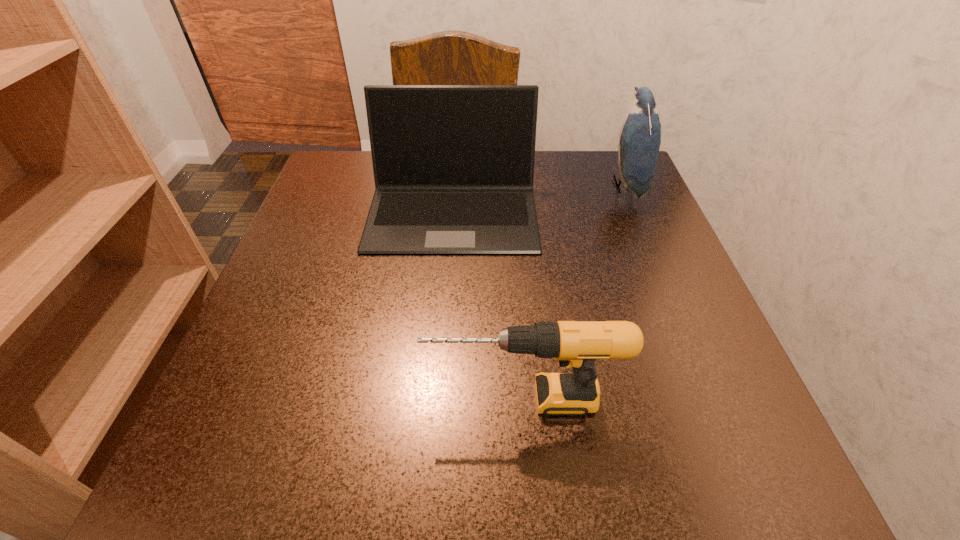
In the image, there is a desktop. What are the coordinates of `vacant area at the near left corner` in the screenshot? It's located at (277, 480).

Locate an element on the screen. vacant space at the far right corner of the desktop is located at coordinates (578, 151).

I want to click on free location at the near right corner, so click(x=654, y=464).

Where is `free space between the rightmost object and the laptop`? This screenshot has height=540, width=960. free space between the rightmost object and the laptop is located at coordinates (539, 199).

Find the location of a particular element. empty space between the laptop and the rightmost object is located at coordinates (539, 199).

You are a GUI agent. You are given a task and a screenshot of the screen. Output one action in this format:
    pyautogui.click(x=<x>, y=<y>)
    Task: Click on the empty location between the drill and the laptop
    
    Given the screenshot: What is the action you would take?
    pyautogui.click(x=488, y=305)

Image resolution: width=960 pixels, height=540 pixels. In order to click on unoccupied area between the drill and the laptop in this screenshot , I will do `click(488, 305)`.

Identify the location of free space between the nearest object and the rightmost object. (574, 292).

Where is `vacant space that's between the rightmost object and the drill`? vacant space that's between the rightmost object and the drill is located at coordinates (574, 292).

Find the location of a particular element. free area in between the shortest object and the bird is located at coordinates (574, 292).